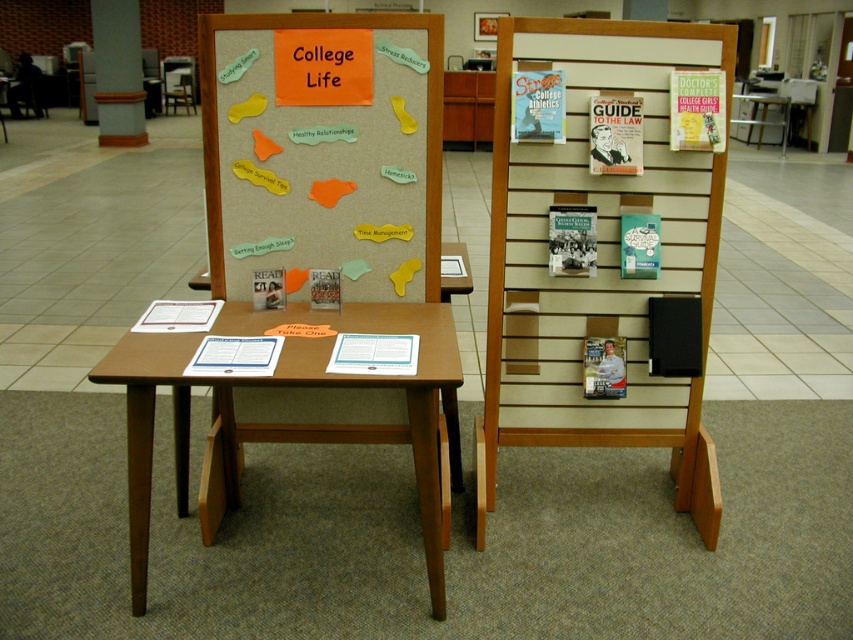
Question: Among these objects, which one is farthest from the camera?

Choices:
 (A) smooth concrete pillar at upper left
 (B) corkboard at center
 (C) brown wooden table at center
 (D) matte plastic chair at center

Answer: (D)

Question: Can you confirm if corkboard at center is positioned above brown wooden table at center?

Choices:
 (A) yes
 (B) no

Answer: (A)

Question: Is wooden slatted display at right bigger than matte plastic chair at center?

Choices:
 (A) yes
 (B) no

Answer: (A)

Question: Which object appears farthest from the camera in this image?

Choices:
 (A) matte plastic chair at center
 (B) wooden slatted display at right

Answer: (A)

Question: Can you confirm if wooden slatted display at right is positioned to the left of brown wooden table at center?

Choices:
 (A) yes
 (B) no

Answer: (B)

Question: Which object appears farthest from the camera in this image?

Choices:
 (A) corkboard at center
 (B) brown wooden table at center
 (C) matte plastic chair at center

Answer: (C)